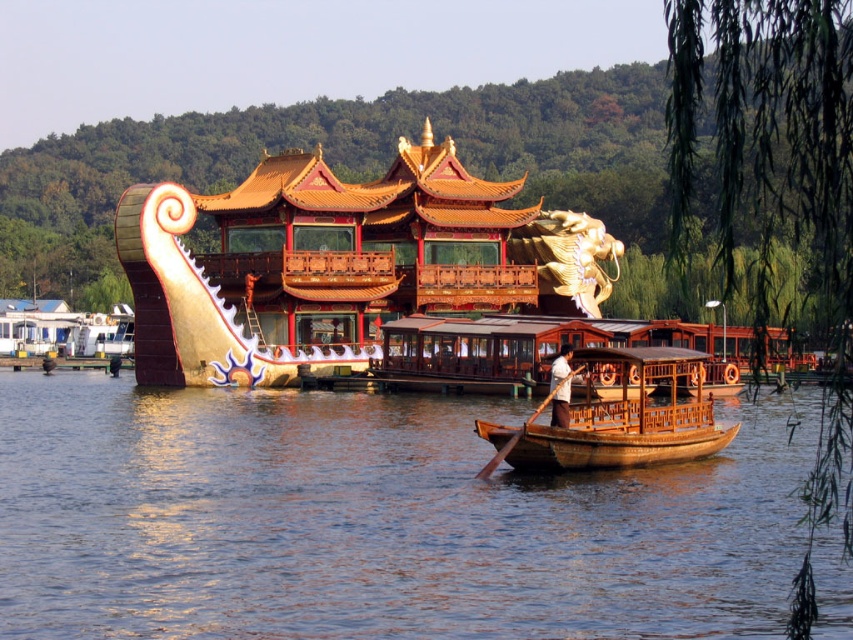
Between point (538, 456) and point (546, 397), which one is positioned behind?

The point (546, 397) is more distant.

Is wooden boat at center thinner than wooden at center?

Incorrect, wooden boat at center's width is not less than wooden at center's.

Is point (566, 458) behind point (490, 460)?

No, (566, 458) is closer to viewer.

Image resolution: width=853 pixels, height=640 pixels. I want to click on wooden boat at center, so click(618, 419).

In the scene shown: Who is more forward, (795,481) or (573,412)?

Point (573,412)

Does brown wooden boat at center have a greater height compared to wooden boat at center?

Yes.

Identify the location of brown wooden boat at center. (373, 520).

Identify the location of brown wooden boat at center. (373, 520).

Who is positioned more to the right, brown wooden boat at center or wooden at center?

From the viewer's perspective, wooden at center appears more on the right side.

Image resolution: width=853 pixels, height=640 pixels. Identify the location of brown wooden boat at center. (373, 520).